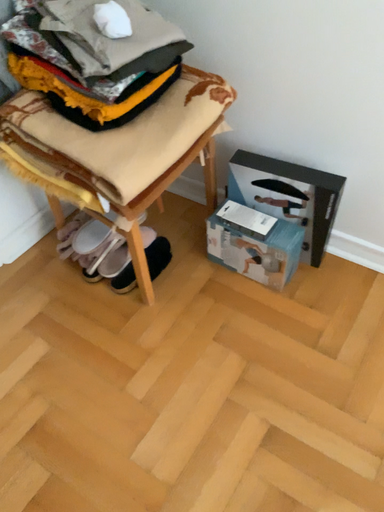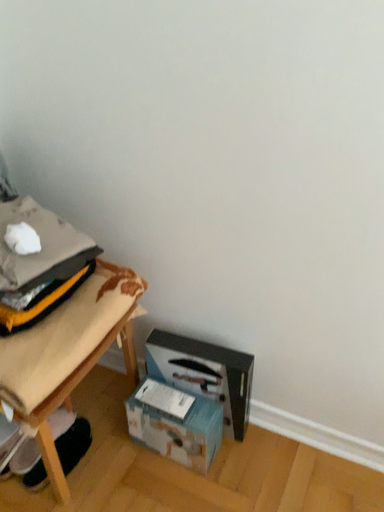
Question: How did the camera likely rotate when shooting the video?

Choices:
 (A) rotated downward
 (B) rotated upward

Answer: (B)